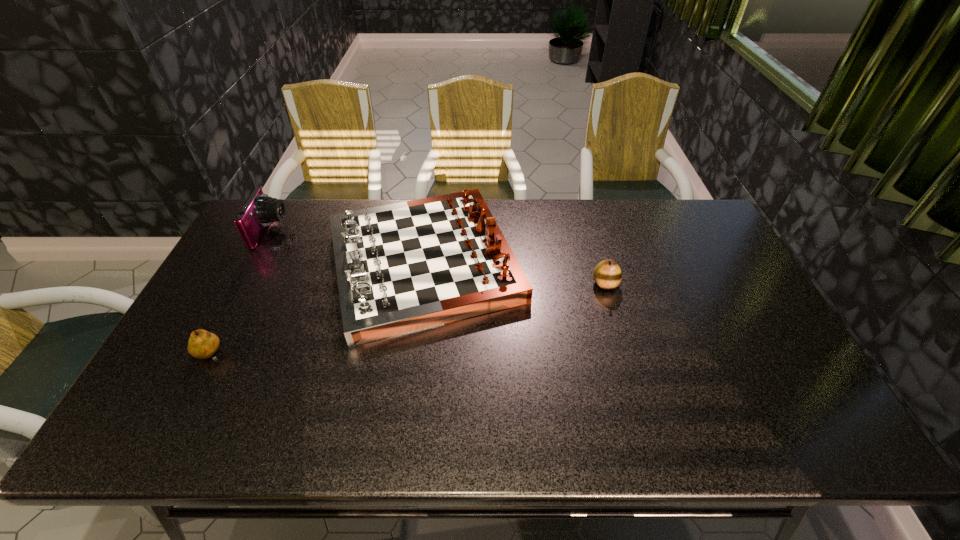
In order to click on free location located 0.280m on the right of the shortest object in this screenshot , I will do `click(337, 355)`.

Locate an element on the screen. The height and width of the screenshot is (540, 960). gameboard at the far edge is located at coordinates [x=403, y=267].

At what (x,y) coordinates should I click in order to perform the action: click on camera that is positioned at the far edge. Please return your answer as a coordinate pair (x, y). Image resolution: width=960 pixels, height=540 pixels. Looking at the image, I should click on (260, 210).

This screenshot has width=960, height=540. What are the coordinates of `camera at the left edge` in the screenshot? It's located at (260, 210).

You are a GUI agent. You are given a task and a screenshot of the screen. Output one action in this format:
    pyautogui.click(x=<x>, y=<y>)
    Task: Click on the pear located at the left edge
    This screenshot has height=540, width=960.
    Given the screenshot: What is the action you would take?
    pyautogui.click(x=202, y=344)

I want to click on object present at the far left corner, so click(260, 210).

The image size is (960, 540). In the image, there is a desktop. Identify the location of free space at the far edge. (632, 210).

At what (x,y) coordinates should I click in order to perform the action: click on vacant space at the near edge of the desktop. Please return your answer as a coordinate pair (x, y). The image size is (960, 540). Looking at the image, I should click on (x=280, y=413).

Find the location of a particular element. The image size is (960, 540). vacant space at the left edge of the desktop is located at coordinates (228, 343).

In the image, there is a desktop. Identify the location of vacant space at the far left corner. This screenshot has width=960, height=540. (269, 231).